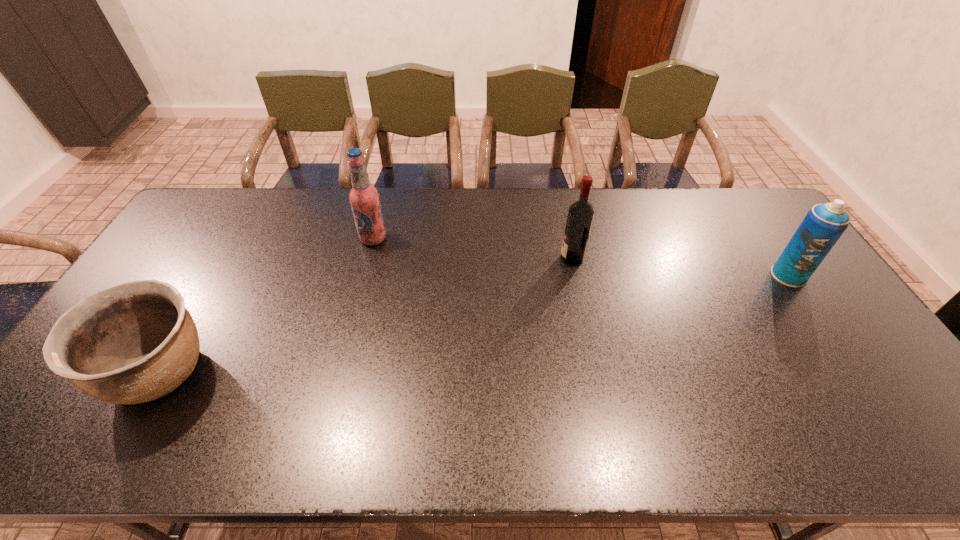
In order to click on object that is the closest one to the second object from right to left in this screenshot , I will do `click(364, 198)`.

Identify which object is located as the nearest to the shortest object. Please provide its 2D coordinates. Your answer should be formatted as a tuple, i.e. [(x, y)], where the tuple contains the x and y coordinates of a point satisfying the conditions above.

[(364, 198)]

The image size is (960, 540). Find the location of `blank area in the image that satisfies the following two spatial constraints: 1. on the front and back of the rightmost object; 2. on the right side of the right alcohol`. blank area in the image that satisfies the following two spatial constraints: 1. on the front and back of the rightmost object; 2. on the right side of the right alcohol is located at coordinates (575, 276).

Locate an element on the screen. Image resolution: width=960 pixels, height=540 pixels. free point that satisfies the following two spatial constraints: 1. on the front and back of the nearer alcohol; 2. on the right side of the aerosol can is located at coordinates (575, 276).

At what (x,y) coordinates should I click in order to perform the action: click on free space that satisfies the following two spatial constraints: 1. on the back side of the rightmost object; 2. on the right side of the nearest object. Please return your answer as a coordinate pair (x, y). The image size is (960, 540). Looking at the image, I should click on (218, 276).

Image resolution: width=960 pixels, height=540 pixels. Identify the location of vacant space that satisfies the following two spatial constraints: 1. on the front side of the left alcohol; 2. on the right side of the aerosol can. (364, 276).

Identify the location of vacant area that satisfies the following two spatial constraints: 1. on the front and back of the rightmost object; 2. on the right side of the nearer alcohol. This screenshot has width=960, height=540. (575, 276).